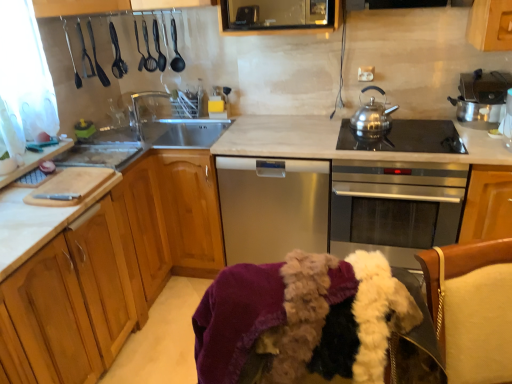
The width and height of the screenshot is (512, 384). Find the location of `blank space situated above stainless steel oven at center (from a real-world perspective)`. blank space situated above stainless steel oven at center (from a real-world perspective) is located at coordinates (399, 143).